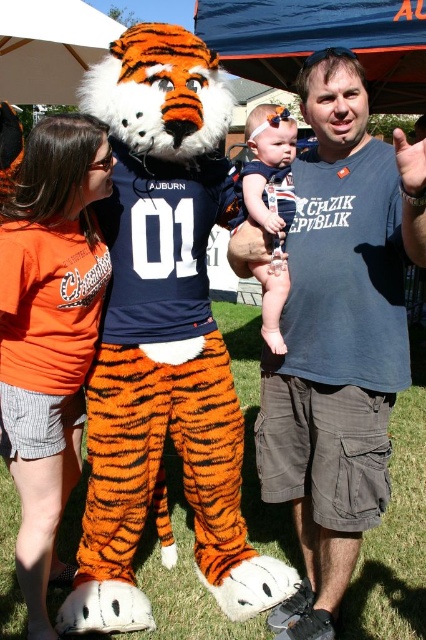
Is point (299, 360) positioned after point (253, 168)?

No, (299, 360) is closer to viewer.

Does matte blue t-shirt at center appear under matte navy blue dress at center?

Yes, matte blue t-shirt at center is below matte navy blue dress at center.

The height and width of the screenshot is (640, 426). What do you see at coordinates (339, 337) in the screenshot?
I see `matte blue t-shirt at center` at bounding box center [339, 337].

Identify the location of matte blue t-shirt at center. The image size is (426, 640). (339, 337).